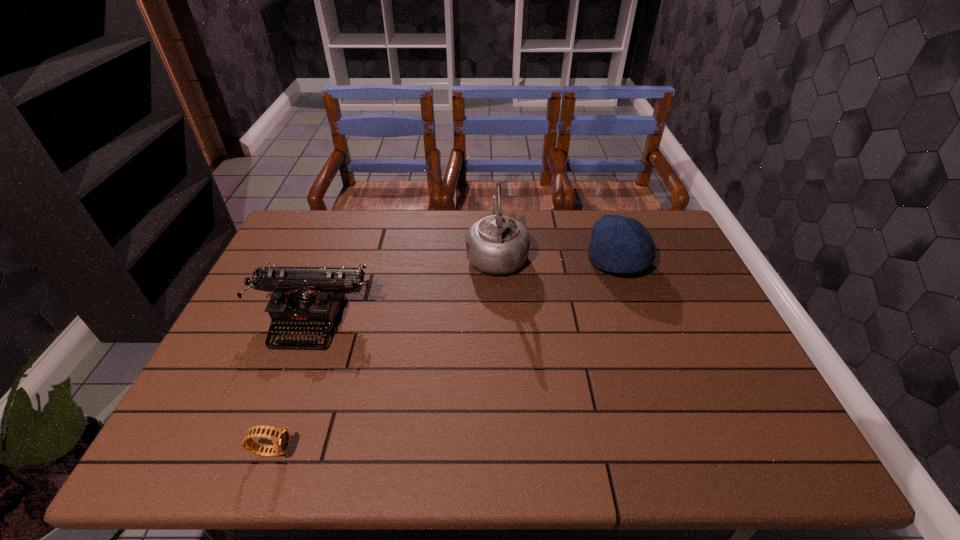
The height and width of the screenshot is (540, 960). I want to click on vacant region at the far left corner of the desktop, so pyautogui.click(x=318, y=237).

The height and width of the screenshot is (540, 960). I want to click on free space at the near left corner, so click(238, 442).

The image size is (960, 540). I want to click on free location at the far right corner, so click(x=684, y=249).

At what (x,y) coordinates should I click in order to perform the action: click on vacant point located between the second object from right to left and the skullcap. Please return your answer as a coordinate pair (x, y). Image resolution: width=960 pixels, height=540 pixels. Looking at the image, I should click on (558, 258).

Find the location of a particular element. This screenshot has height=540, width=960. free space between the third object from left to right and the rightmost object is located at coordinates (558, 258).

Where is `empty location between the typewriter and the kettle`? empty location between the typewriter and the kettle is located at coordinates (405, 287).

Image resolution: width=960 pixels, height=540 pixels. I want to click on vacant space that's between the third farthest object and the shortest object, so click(x=293, y=385).

Identify the location of free space between the nearest object and the second object from right to left. Image resolution: width=960 pixels, height=540 pixels. (384, 352).

Image resolution: width=960 pixels, height=540 pixels. What are the coordinates of `free area in between the rightmost object and the shortest object` in the screenshot? It's located at (444, 356).

In order to click on unoccupied position between the nearest object and the kettle in this screenshot , I will do `click(384, 352)`.